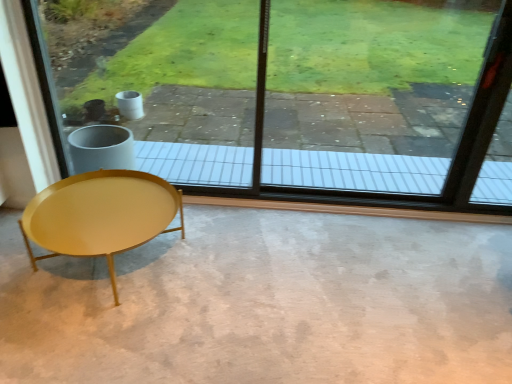
Question: Is smooth concrete floor at center smaller than shiny gold coffee table at lower left?

Choices:
 (A) yes
 (B) no

Answer: (B)

Question: Considering the relative positions of smooth concrete floor at center and shiny gold coffee table at lower left in the image provided, is smooth concrete floor at center behind shiny gold coffee table at lower left?

Choices:
 (A) yes
 (B) no

Answer: (B)

Question: Does smooth concrete floor at center have a greater width compared to shiny gold coffee table at lower left?

Choices:
 (A) no
 (B) yes

Answer: (B)

Question: Could you tell me if smooth concrete floor at center is turned towards shiny gold coffee table at lower left?

Choices:
 (A) no
 (B) yes

Answer: (A)

Question: From the image's perspective, is smooth concrete floor at center under shiny gold coffee table at lower left?

Choices:
 (A) no
 (B) yes

Answer: (B)

Question: From the image's perspective, relative to transparent glass window at center, is shiny gold coffee table at lower left above or below?

Choices:
 (A) below
 (B) above

Answer: (A)

Question: Is shiny gold coffee table at lower left taller or shorter than transparent glass window at center?

Choices:
 (A) short
 (B) tall

Answer: (A)

Question: Considering the positions of point (68, 215) and point (239, 48), is point (68, 215) closer or farther from the camera than point (239, 48)?

Choices:
 (A) farther
 (B) closer

Answer: (B)

Question: Is shiny gold coffee table at lower left in front of or behind transparent glass window at center in the image?

Choices:
 (A) front
 (B) behind

Answer: (A)

Question: Is transparent glass window at center bigger or smaller than smooth concrete floor at center?

Choices:
 (A) small
 (B) big

Answer: (B)

Question: Looking at their shapes, would you say transparent glass window at center is wider or thinner than smooth concrete floor at center?

Choices:
 (A) thin
 (B) wide

Answer: (A)

Question: Is transparent glass window at center to the left or to the right of smooth concrete floor at center in the image?

Choices:
 (A) left
 (B) right

Answer: (B)

Question: From a real-world perspective, is transparent glass window at center physically located above or below smooth concrete floor at center?

Choices:
 (A) above
 (B) below

Answer: (A)

Question: From a real-world perspective, relative to transparent glass window at center, is smooth concrete floor at center vertically above or below?

Choices:
 (A) below
 (B) above

Answer: (A)

Question: From the image's perspective, relative to transparent glass window at center, is smooth concrete floor at center above or below?

Choices:
 (A) below
 (B) above

Answer: (A)